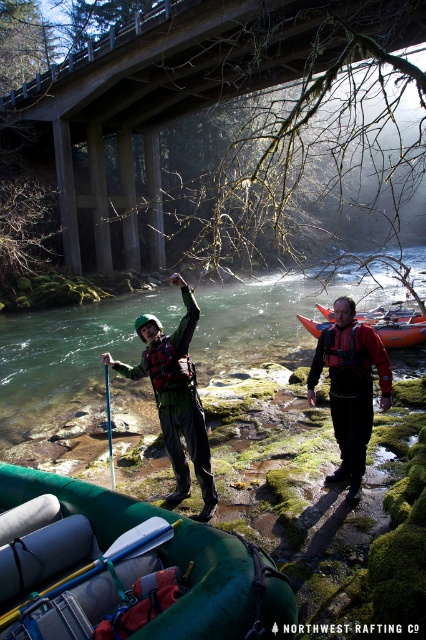
Between green rubber raft at lower left and orange rubber raft at center, which one has less height?

With less height is green rubber raft at lower left.

Who is lower down, green rubber raft at lower left or orange rubber raft at center?

green rubber raft at lower left is below.

This screenshot has width=426, height=640. What are the coordinates of `green rubber raft at lower left` in the screenshot? It's located at (207, 586).

Identify the location of green rubber raft at lower left. (207, 586).

Does red life vest at center lie behind red nylon life jacket at center?

No, red life vest at center is closer to the viewer.

Who is positioned more to the left, red life vest at center or red nylon life jacket at center?

Positioned to the left is red nylon life jacket at center.

Image resolution: width=426 pixels, height=640 pixels. What are the coordinates of `red life vest at center` in the screenshot? It's located at 351,387.

What are the coordinates of `red life vest at center` in the screenshot? It's located at coord(351,387).

Does green rubber raft at lower left have a lesser height compared to blue plastic paddle at lower left?

Incorrect, green rubber raft at lower left's height does not fall short of blue plastic paddle at lower left's.

Between point (210, 548) and point (89, 573), which one is positioned behind?

Point (210, 548)

Find the location of `green rubber raft at lower left`. green rubber raft at lower left is located at coordinates (207, 586).